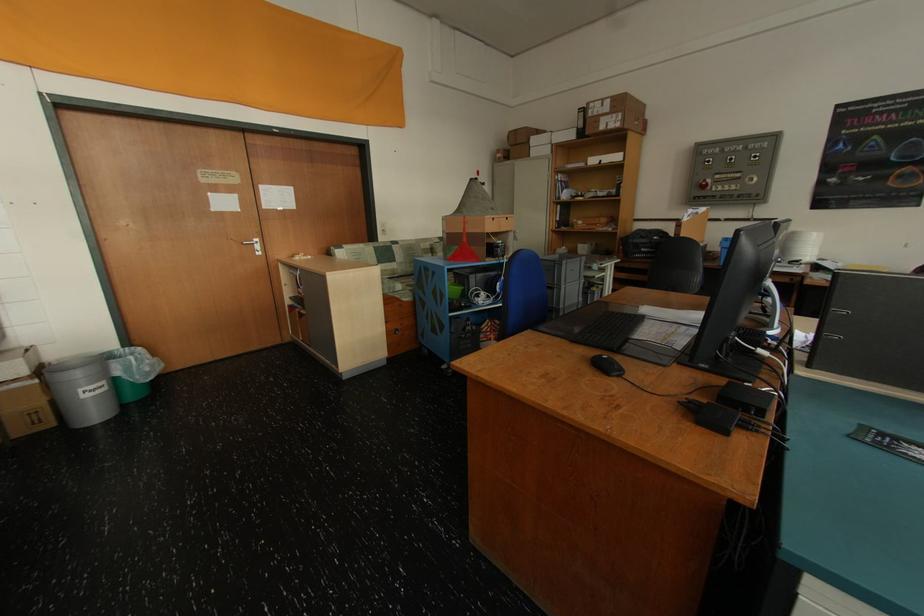
What do you see at coordinates (464, 249) in the screenshot? I see `the red funnel` at bounding box center [464, 249].